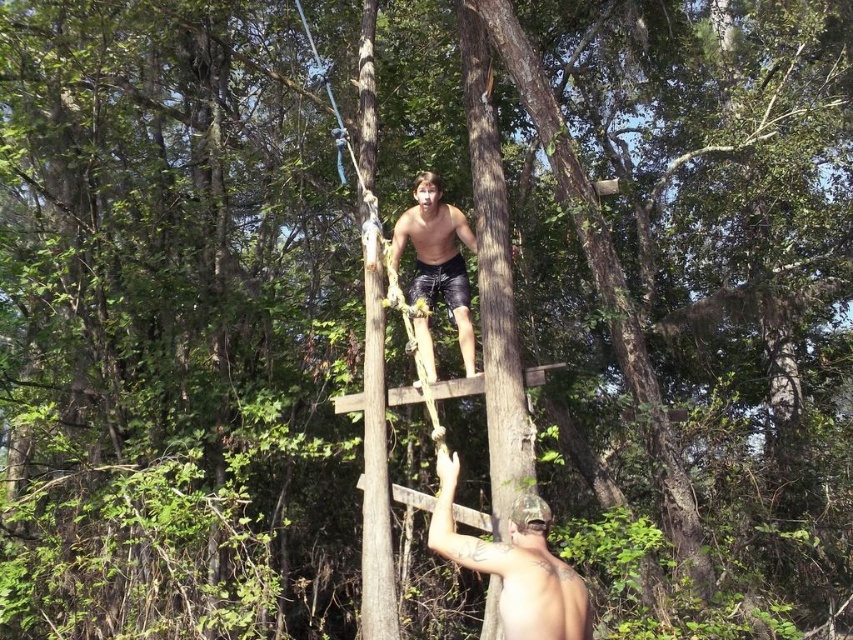
Question: Can you confirm if brown rough wood pole at center is smaller than shiny black shorts at center?

Choices:
 (A) no
 (B) yes

Answer: (A)

Question: Which object is closer to the camera taking this photo?

Choices:
 (A) shiny silver helmet at lower right
 (B) brown rough wood pole at center

Answer: (A)

Question: Does shiny silver helmet at lower right appear under shiny black shorts at center?

Choices:
 (A) yes
 (B) no

Answer: (A)

Question: Can you confirm if shiny silver helmet at lower right is positioned below shiny black shorts at center?

Choices:
 (A) no
 (B) yes

Answer: (B)

Question: Among these objects, which one is farthest from the camera?

Choices:
 (A) brown rough wood pole at center
 (B) shiny black shorts at center
 (C) shiny silver helmet at lower right

Answer: (B)

Question: Which of the following is the closest to the observer?

Choices:
 (A) (466, 241)
 (B) (363, 113)

Answer: (A)